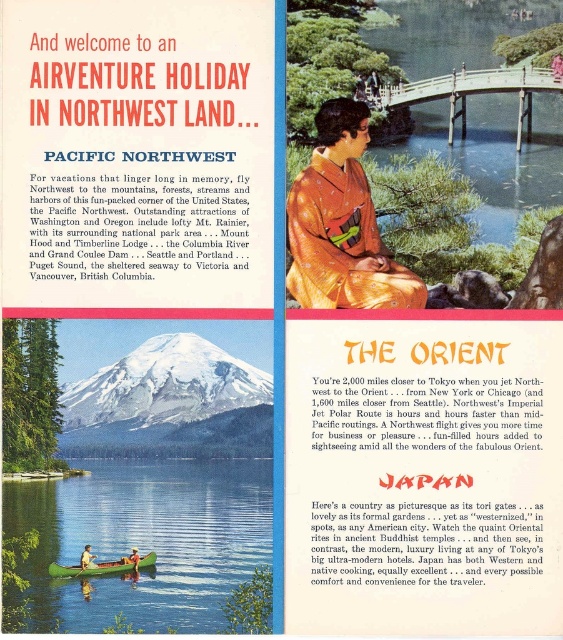
From the picture: You are a traveler looking at this advertisement and want to know the spatial relationship between the green smooth water at lower left and the matte orange kimono at upper center. Which object is located to the right of the other?

The green smooth water at lower left is positioned on the right side of matte orange kimono at upper center.

You are a travel agent planning a trip for a client who wants to visit both the Pacific Northwest and Japan. They ask which destination has a larger area for the specific landmarks shown in the image. Based on the image, which area is bigger between the green smooth water at lower left and the orange silk kimono at center?

The green smooth water at lower left is larger in size than the orange silk kimono at center, so the Pacific Northwest section in the image shows a larger area for its landmark compared to the Japan section.